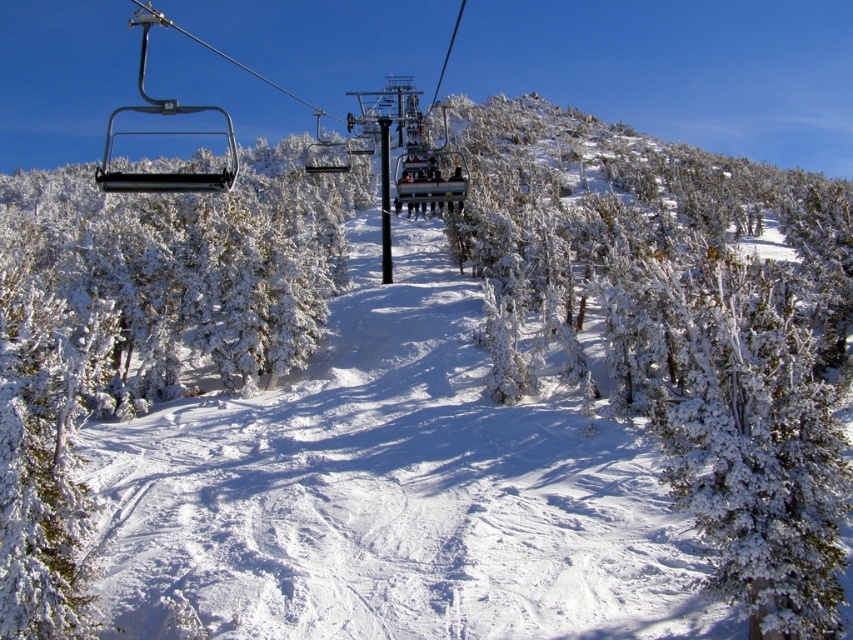
Can you confirm if snow-covered evergreen at center is positioned to the right of white frosty tree at left?

Indeed, snow-covered evergreen at center is positioned on the right side of white frosty tree at left.

In the scene shown: Is snow-covered evergreen at center positioned behind white frosty tree at left?

That is False.

At what (x,y) coordinates should I click in order to perform the action: click on snow-covered evergreen at center. Please return your answer as a coordinate pair (x, y). Looking at the image, I should click on (718, 356).

Identify the location of snow-covered evergreen at center. This screenshot has width=853, height=640. (718, 356).